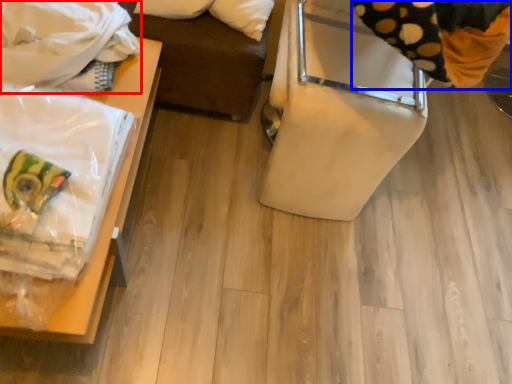
Question: Which of the following is the closest to the observer, blanket (highlighted by a red box) or material (highlighted by a blue box)?

Choices:
 (A) blanket
 (B) material

Answer: (B)